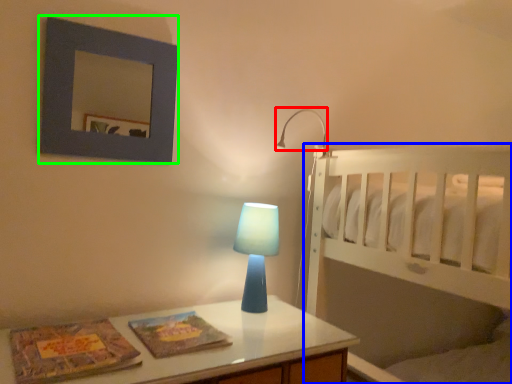
Question: Considering the real-world distances, which object is farthest from lamp (highlighted by a red box)? bed (highlighted by a blue box) or picture frame (highlighted by a green box)?

Choices:
 (A) bed
 (B) picture frame

Answer: (B)